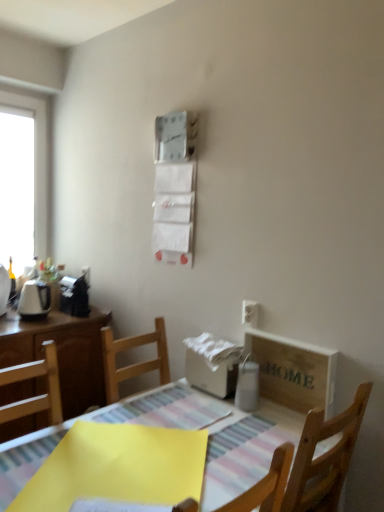
You are a GUI agent. You are given a task and a screenshot of the screen. Output one action in this format:
    pyautogui.click(x=<x>, y=<y>)
    Task: Click on the spots to the right of yellow paper at lower left
    This screenshot has width=384, height=512.
    Given the screenshot: What is the action you would take?
    [239, 448]